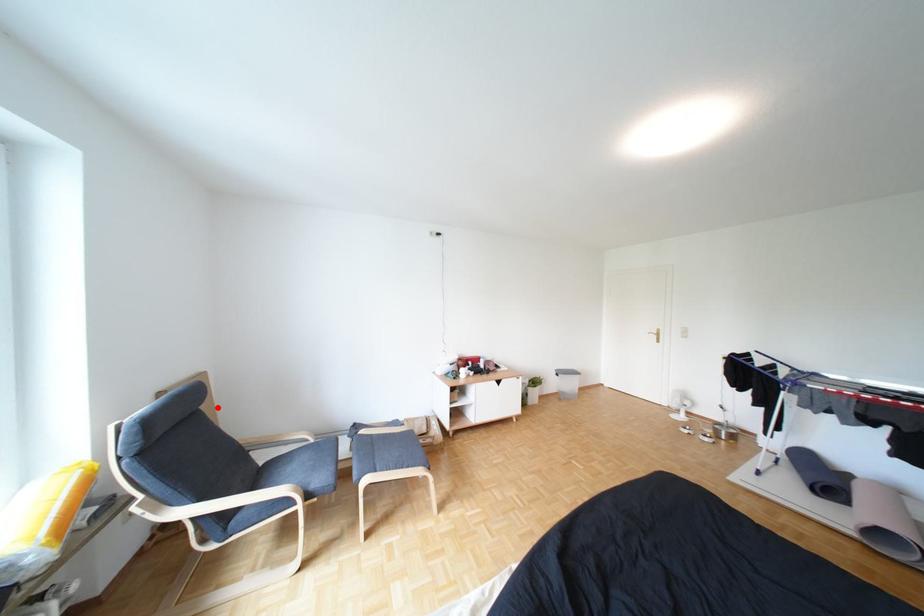
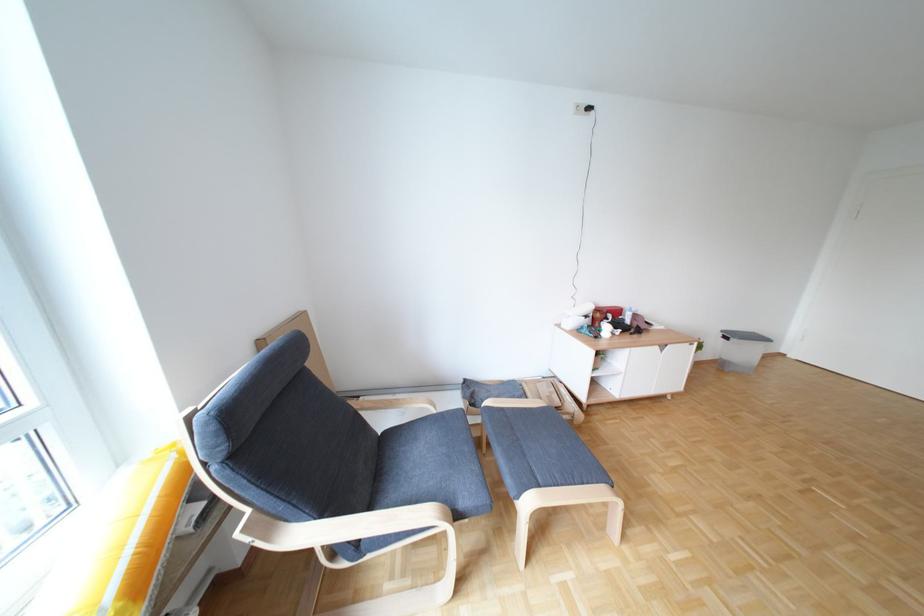
Question: I am providing you with two images of the same scene from different viewpoints. In image1, a red point is highlighted. Considering the same 3D point in image2, which of the following is correct?

Choices:
 (A) It is closer
 (B) It is farther

Answer: (A)